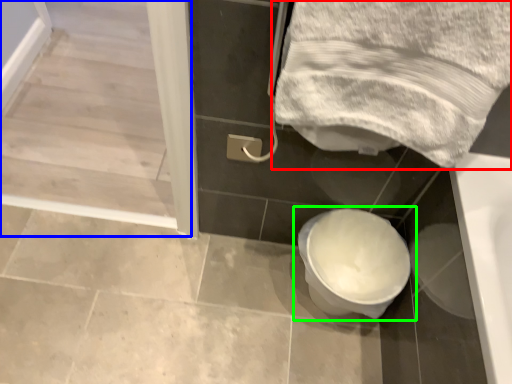
Question: Estimate the real-world distances between objects in this image. Which object is farther from towel (highlighted by a red box), screen door (highlighted by a blue box) or toilet (highlighted by a green box)?

Choices:
 (A) screen door
 (B) toilet

Answer: (A)